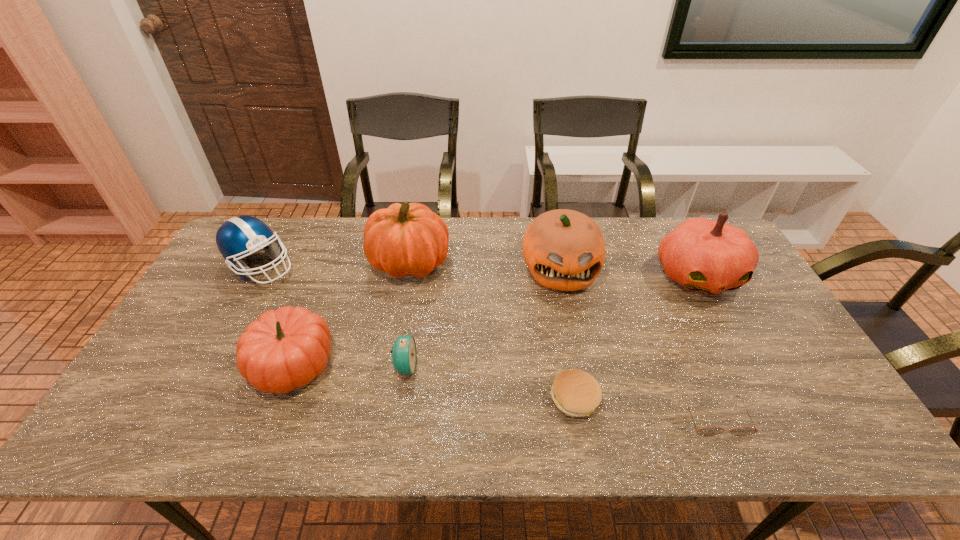
Where is `the third pumpkin from right to left`? This screenshot has height=540, width=960. the third pumpkin from right to left is located at coordinates (405, 239).

Image resolution: width=960 pixels, height=540 pixels. I want to click on the rightmost pumpkin, so tap(703, 255).

I want to click on the third pumpkin from left to right, so click(x=564, y=249).

Identify the location of football helmet. This screenshot has height=540, width=960. (238, 237).

This screenshot has height=540, width=960. Identify the location of the nearest pumpkin. (286, 348).

Identify the location of the leftmost pumpkin. (286, 348).

At what (x,y) coordinates should I click in order to perform the action: click on the sixth tallest object. Please return your answer as a coordinate pair (x, y). The width and height of the screenshot is (960, 540). Looking at the image, I should click on (404, 356).

At what (x,y) coordinates should I click in order to perform the action: click on the second shortest object. Please return your answer as a coordinate pair (x, y). Looking at the image, I should click on coord(576,393).

Locate an element on the screen. sunglasses is located at coordinates (708, 431).

Locate an element on the screen. blank area located on the left of the third pumpkin from right to left is located at coordinates (254, 262).